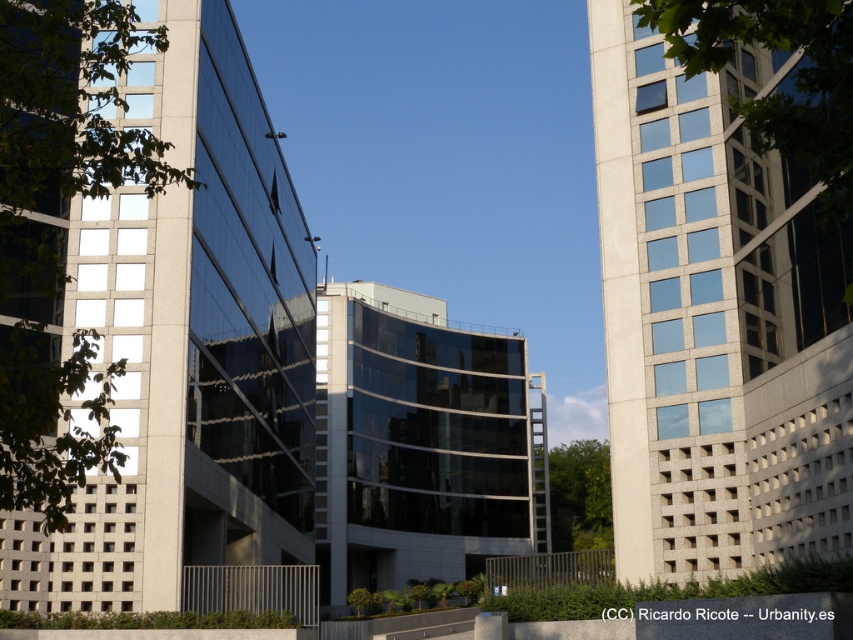
Between matte glass building at center and white textured building at right, which one is positioned higher?

white textured building at right is higher up.

Who is lower down, matte glass building at center or white textured building at right?

matte glass building at center is lower down.

Does point (177, 252) come closer to viewer compared to point (619, 412)?

Yes, point (177, 252) is in front of point (619, 412).

Identify the location of matte glass building at center. (184, 342).

Which is more to the left, matte glass building at center or glossy glass building at center?

From the viewer's perspective, matte glass building at center appears more on the left side.

In the scene shown: Does matte glass building at center appear over glossy glass building at center?

Correct, matte glass building at center is located above glossy glass building at center.

Is point (102, 301) closer to viewer compared to point (368, 524)?

Yes, point (102, 301) is in front of point (368, 524).

This screenshot has height=640, width=853. I want to click on matte glass building at center, so tap(184, 342).

Is point (821, 285) behind point (335, 285)?

No, (821, 285) is in front of (335, 285).

Who is higher up, white textured building at right or glossy glass building at center?

white textured building at right is higher up.

Is point (838, 364) farther from viewer compared to point (535, 472)?

No, it is in front of (535, 472).

The width and height of the screenshot is (853, 640). I want to click on white textured building at right, so click(x=711, y=317).